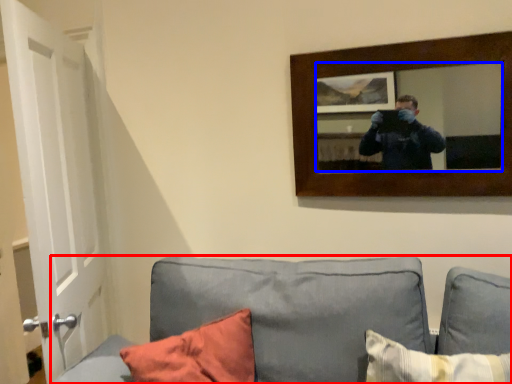
Question: Among these objects, which one is nearest to the camera, studio couch (highlighted by a red box) or mirror (highlighted by a blue box)?

Choices:
 (A) studio couch
 (B) mirror

Answer: (A)